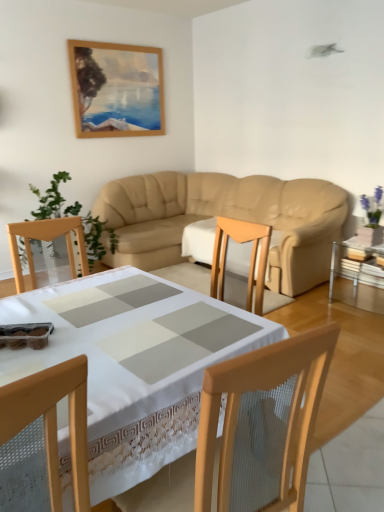
Question: From a real-world perspective, is wooden chair at lower left over clear glass table at right, arranged as the 2th table when viewed from the left?

Choices:
 (A) yes
 (B) no

Answer: (A)

Question: Is wooden chair at lower left aimed at clear glass table at right, placed as the first table when sorted from right to left?

Choices:
 (A) yes
 (B) no

Answer: (B)

Question: Can you confirm if wooden chair at lower left is taller than clear glass table at right, placed as the first table when sorted from right to left?

Choices:
 (A) yes
 (B) no

Answer: (A)

Question: Is wooden chair at lower left outside clear glass table at right, which is the first table in back-to-front order?

Choices:
 (A) no
 (B) yes

Answer: (B)

Question: From the image's perspective, is wooden chair at lower left on clear glass table at right, which is the first table in back-to-front order?

Choices:
 (A) no
 (B) yes

Answer: (A)

Question: From a real-world perspective, is clear glass table at right, which ranks as the second table in front-to-back order, positioned above or below white lace tablecloth at center, the 1th table from the left?

Choices:
 (A) below
 (B) above

Answer: (A)

Question: Considering the positions of point (362, 288) and point (206, 345), is point (362, 288) closer or farther from the camera than point (206, 345)?

Choices:
 (A) farther
 (B) closer

Answer: (A)

Question: In the image, is clear glass table at right, placed as the first table when sorted from right to left, positioned in front of or behind white lace tablecloth at center, which is the 2th table in back-to-front order?

Choices:
 (A) behind
 (B) front

Answer: (A)

Question: In the image, is clear glass table at right, which ranks as the second table in front-to-back order, on the left side or the right side of white lace tablecloth at center, the 1th table from the left?

Choices:
 (A) left
 (B) right

Answer: (B)

Question: Considering the positions of point pyautogui.click(x=94, y=232) and point pyautogui.click(x=195, y=360), is point pyautogui.click(x=94, y=232) closer or farther from the camera than point pyautogui.click(x=195, y=360)?

Choices:
 (A) farther
 (B) closer

Answer: (A)

Question: In the image, is green leafy plant at left on the left side or the right side of white lace tablecloth at center, the 1th table from the left?

Choices:
 (A) left
 (B) right

Answer: (A)

Question: Considering the positions of green leafy plant at left and white lace tablecloth at center, arranged as the first table when viewed from the front, in the image, is green leafy plant at left bigger or smaller than white lace tablecloth at center, arranged as the first table when viewed from the front,?

Choices:
 (A) small
 (B) big

Answer: (B)

Question: Would you say green leafy plant at left is inside or outside white lace tablecloth at center, which is the 2th table in back-to-front order?

Choices:
 (A) inside
 (B) outside

Answer: (B)

Question: Considering the positions of point (16, 493) and point (367, 285), is point (16, 493) closer or farther from the camera than point (367, 285)?

Choices:
 (A) farther
 (B) closer

Answer: (B)

Question: From the image's perspective, is wooden chair at lower left above or below clear glass table at right, which is the first table in back-to-front order?

Choices:
 (A) below
 (B) above

Answer: (A)